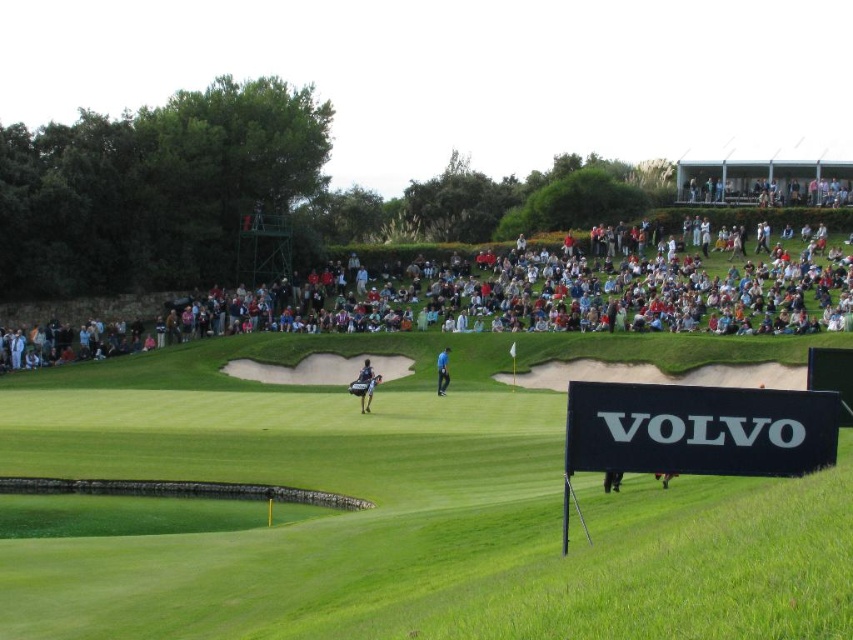
Can you confirm if multicolored fabric crowd at upper center is wider than dark blue fabric golf bag at center?

Yes, multicolored fabric crowd at upper center is wider than dark blue fabric golf bag at center.

Is point (392, 307) closer to camera compared to point (367, 380)?

No, (392, 307) is further to viewer.

The height and width of the screenshot is (640, 853). I want to click on multicolored fabric crowd at upper center, so click(488, 304).

This screenshot has height=640, width=853. Describe the element at coordinates (402, 516) in the screenshot. I see `green grass at center` at that location.

How far apart are green grass at center and dark blue fabric golf bag at center?

A distance of 20.12 meters exists between green grass at center and dark blue fabric golf bag at center.

Between point (490, 352) and point (370, 387), which one is positioned behind?

The point (490, 352) is behind.

The width and height of the screenshot is (853, 640). In order to click on green grass at center in this screenshot , I will do `click(402, 516)`.

Does black plastic sign at lower right lie in front of dark blue fabric golf bag at center?

Yes, it is.

Does point (770, 419) come closer to viewer compared to point (368, 378)?

Yes.

Describe the element at coordinates (698, 429) in the screenshot. I see `black plastic sign at lower right` at that location.

I want to click on black plastic sign at lower right, so click(698, 429).